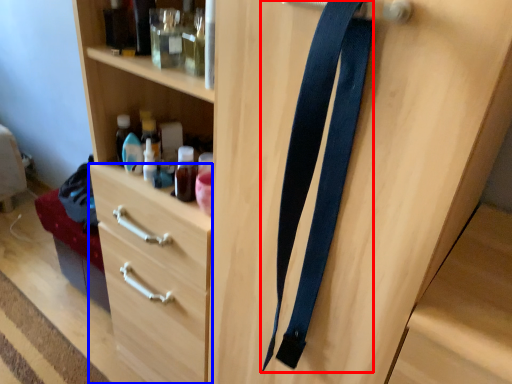
Question: Which object is closer to the camera taking this photo, suspenders (highlighted by a red box) or drawer (highlighted by a blue box)?

Choices:
 (A) suspenders
 (B) drawer

Answer: (A)